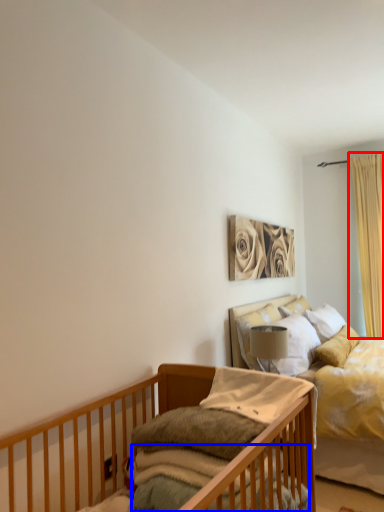
Question: Which object appears farthest to the camera in this image, curtain (highlighted by a red box) or mattress (highlighted by a blue box)?

Choices:
 (A) curtain
 (B) mattress

Answer: (A)